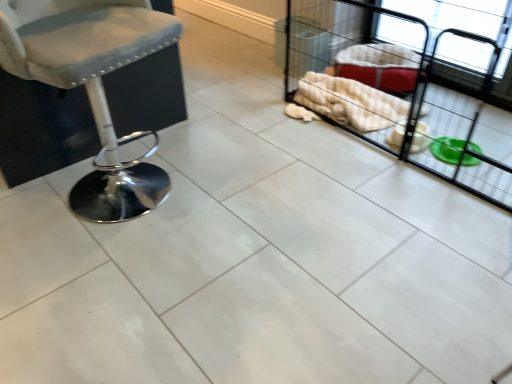
Where is `vacant space that is to the left of white fabric baby carriage at right`? This screenshot has width=512, height=384. vacant space that is to the left of white fabric baby carriage at right is located at coordinates (216, 192).